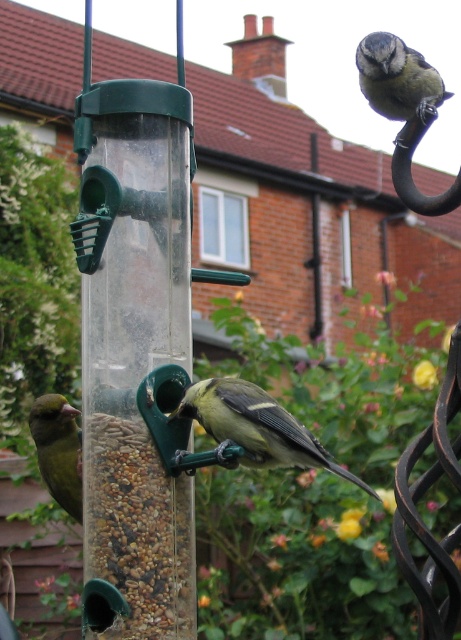
Question: Which object is the farthest from the yellow matte bird at center?

Choices:
 (A) green matte bird at left
 (B) blue speckled bird at upper right

Answer: (A)

Question: Does yellow matte bird at center have a lesser width compared to green matte bird at left?

Choices:
 (A) yes
 (B) no

Answer: (B)

Question: Which of the following is the closest to the observer?

Choices:
 (A) green matte bird at left
 (B) yellow matte bird at center

Answer: (B)

Question: Observing the image, what is the correct spatial positioning of yellow matte bird at center in reference to green matte bird at left?

Choices:
 (A) left
 (B) right

Answer: (B)

Question: Which object is farther from the camera taking this photo?

Choices:
 (A) green matte bird at left
 (B) yellow matte bird at center

Answer: (A)

Question: Does yellow matte bird at center appear over blue speckled bird at upper right?

Choices:
 (A) yes
 (B) no

Answer: (B)